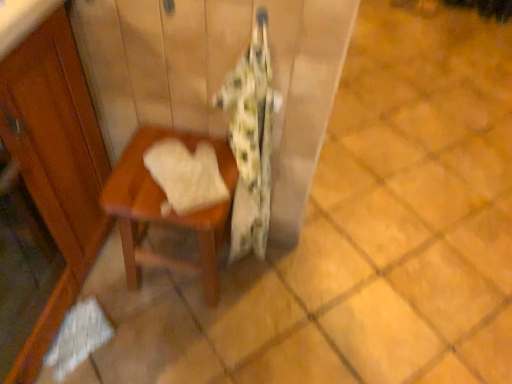
The width and height of the screenshot is (512, 384). In order to click on vacant area situated below wooden table at center (from a real-world perspective) in this screenshot , I will do `click(173, 279)`.